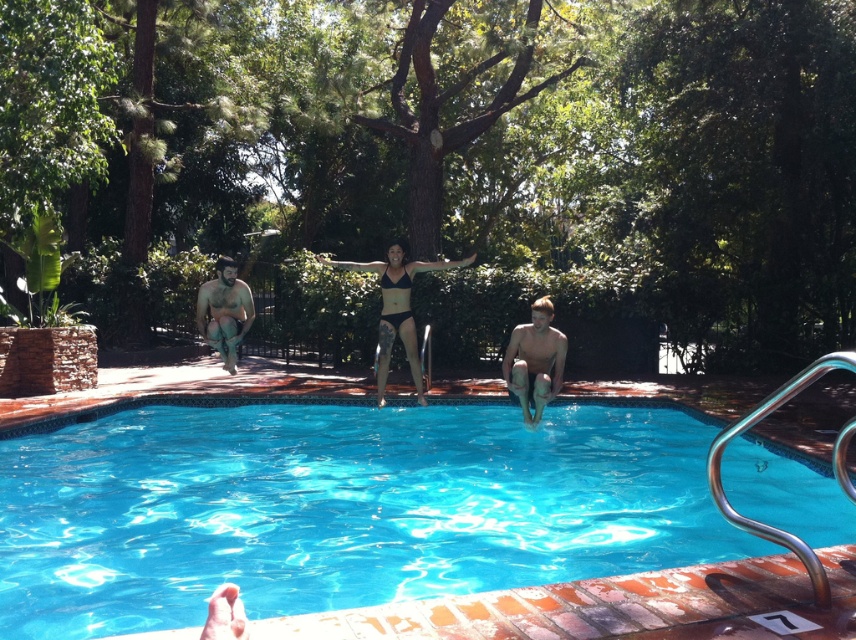
Question: Is blue glossy water at center wider than smooth skin man at center?

Choices:
 (A) no
 (B) yes

Answer: (A)

Question: Can you confirm if black matte bikini at center is positioned above beige fabric shorts at left?

Choices:
 (A) yes
 (B) no

Answer: (A)

Question: Among these points, which one is nearest to the camera?

Choices:
 (A) (381, 324)
 (B) (64, 547)
 (C) (562, 339)
 (D) (232, 260)

Answer: (B)

Question: Which point appears closest to the camera in this image?

Choices:
 (A) (811, 625)
 (B) (230, 344)
 (C) (530, 348)

Answer: (A)

Question: Considering the relative positions of smooth skin man at center and beige fabric shorts at left in the image provided, where is smooth skin man at center located with respect to beige fabric shorts at left?

Choices:
 (A) above
 (B) below

Answer: (B)

Question: Which point is closer to the camera?

Choices:
 (A) (519, 403)
 (B) (215, 282)
 (C) (399, 248)
 (D) (189, 528)

Answer: (D)